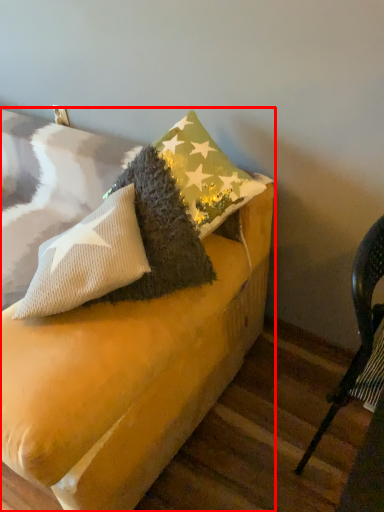
Question: From the image's perspective, where is furniture (annotated by the red box) located relative to chair?

Choices:
 (A) above
 (B) below

Answer: (A)